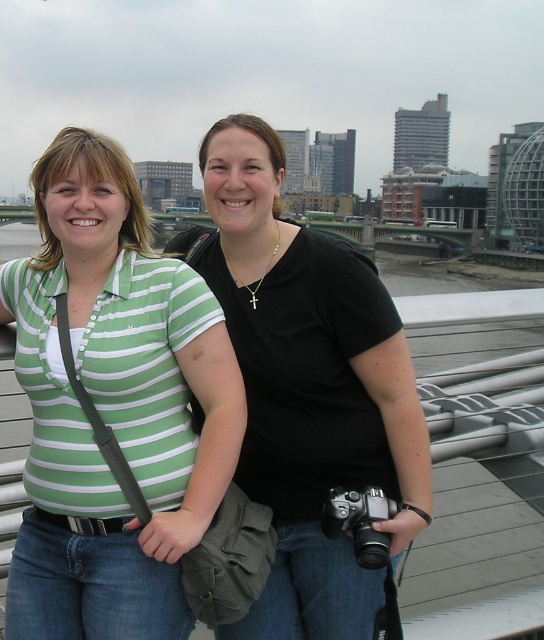
Does green striped shirt at left appear on the right side of black matte shirt at center?

No, green striped shirt at left is not to the right of black matte shirt at center.

Is green striped shirt at left wider than black matte shirt at center?

No, green striped shirt at left is not wider than black matte shirt at center.

At what (x,y) coordinates should I click in order to perform the action: click on green striped shirt at left. Please return your answer as a coordinate pair (x, y). The height and width of the screenshot is (640, 544). Looking at the image, I should click on (113, 406).

Between black matte shirt at center and silver metallic camera at lower center, which one appears on the right side from the viewer's perspective?

Positioned to the right is silver metallic camera at lower center.

Looking at this image, who is shorter, black matte shirt at center or silver metallic camera at lower center?

Standing shorter between the two is silver metallic camera at lower center.

Is point (293, 362) farther from viewer compared to point (387, 513)?

That is True.

You are a GUI agent. You are given a task and a screenshot of the screen. Output one action in this format:
    pyautogui.click(x=<x>, y=<y>)
    Task: Click on the black matte shirt at center
    
    Given the screenshot: What is the action you would take?
    pyautogui.click(x=308, y=388)

Is point (95, 449) farther from viewer compared to point (378, 554)?

That is True.

Is green striped shirt at left positioned at the back of silver metallic camera at lower center?

That is False.

What do you see at coordinates (113, 406) in the screenshot?
I see `green striped shirt at left` at bounding box center [113, 406].

At what (x,y) coordinates should I click in order to perform the action: click on green striped shirt at left. Please return your answer as a coordinate pair (x, y). This screenshot has width=544, height=640. Looking at the image, I should click on (113, 406).